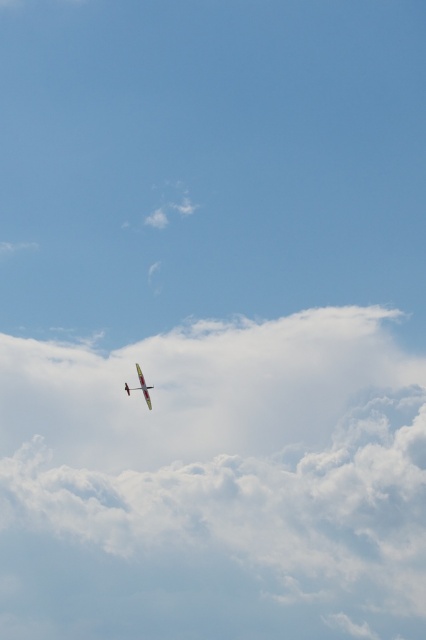
You are a drone operator trying to navigate your drone between the white fluffy cloud at upper center and the small, colorful model airplane. Based on their positions, can your drone safely pass between them without colliding?

The white fluffy cloud at upper center is located at point [215,483], so yes, the drone can safely pass between them as long as it navigates according to their coordinates.

You are a pilot of a small aircraft. You notice a white fluffy cloud at upper center and a metallic silver airplane at center in the sky. Which object is bigger in size?

The white fluffy cloud at upper center is larger in size compared to the metallic silver airplane at center.

You are a pilot flying a small plane and want to avoid the white fluffy cloud at upper center. The plane can climb to a maximum altitude of 600 meters. Can you safely fly over the cloud without getting too close?

The white fluffy cloud at upper center is 637.92 meters away from the viewer. Since the plane can only climb to 600 meters, it cannot reach the required altitude to safely fly over the cloud without getting too close.